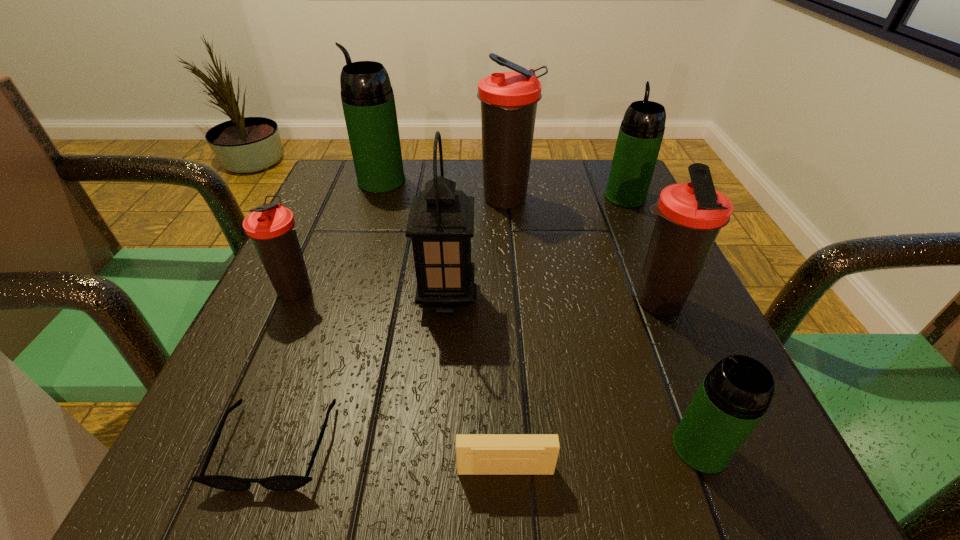
Locate an element on the screen. vacant space located 0.150m on the front of the leftmost brown thermos bottle is located at coordinates (256, 382).

In order to click on free space located 0.240m from the spout of the nearest green thermos bottle in this screenshot , I will do (482, 447).

The width and height of the screenshot is (960, 540). I want to click on vacant space located 0.390m from the spout of the nearest green thermos bottle, so click(x=362, y=447).

At what (x,y) coordinates should I click in order to perform the action: click on vacant space located 0.160m from the spout of the nearest green thermos bottle. Please return your answer as a coordinate pair (x, y). This screenshot has height=540, width=960. Looking at the image, I should click on (545, 447).

Identify the location of thermos bottle at the near edge. (734, 396).

Locate an element on the screen. videotape that is at the near edge is located at coordinates (476, 454).

I want to click on sunglasses positioned at the near edge, so click(280, 482).

Find the location of a particular element. The width and height of the screenshot is (960, 540). sunglasses at the left edge is located at coordinates pyautogui.click(x=280, y=482).

The width and height of the screenshot is (960, 540). What are the coordinates of `object located at the far left corner` in the screenshot? It's located at (367, 97).

This screenshot has height=540, width=960. I want to click on object that is positioned at the near left corner, so click(x=280, y=482).